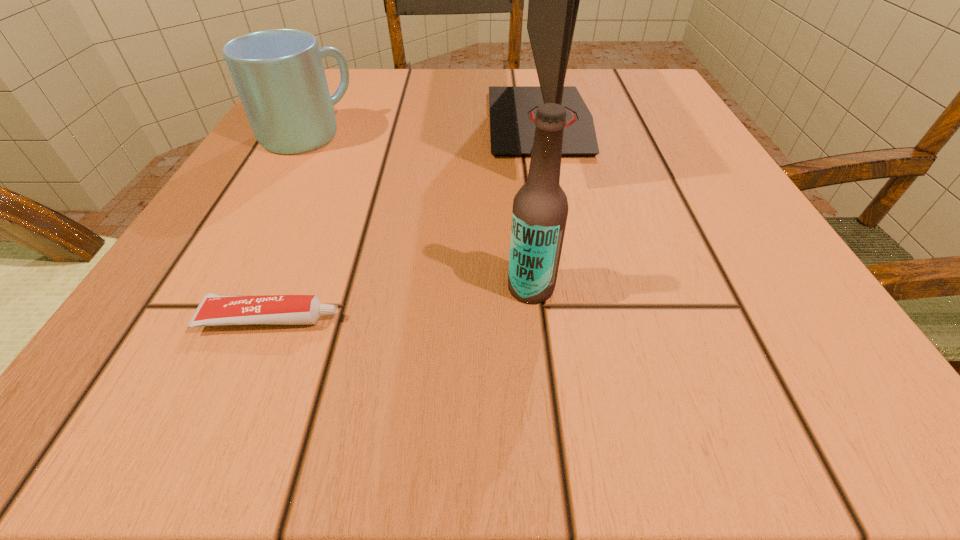
The height and width of the screenshot is (540, 960). Find the location of `vacant area at the right edge`. vacant area at the right edge is located at coordinates (755, 326).

The image size is (960, 540). What are the coordinates of `free space at the far left corner of the desktop` in the screenshot? It's located at (358, 122).

In the image, there is a desktop. What are the coordinates of `free space at the near left corner` in the screenshot? It's located at (121, 411).

Find the location of a particular element. Image resolution: width=960 pixels, height=540 pixels. vacant space at the far right corner of the desktop is located at coordinates (606, 123).

Find the location of a particular element. The width and height of the screenshot is (960, 540). free space at the near right corner of the desktop is located at coordinates [832, 394].

Locate an element on the screen. The image size is (960, 540). free area in between the third shortest object and the toothpaste is located at coordinates (401, 303).

The height and width of the screenshot is (540, 960). What are the coordinates of `free space that is in between the beer bottle and the shortest object` in the screenshot? It's located at (401, 303).

You are a GUI agent. You are given a task and a screenshot of the screen. Output one action in this format:
    pyautogui.click(x=<x>, y=<y>)
    Task: Click on the unoccupied position between the shortest object and the third shortest object
    This screenshot has width=960, height=540.
    Given the screenshot: What is the action you would take?
    coord(401,303)

Where is `vacant area that lies between the toothpaste and the beer bottle`? This screenshot has height=540, width=960. vacant area that lies between the toothpaste and the beer bottle is located at coordinates (401, 303).

Identify the location of vacant area that lies between the third shortest object and the toothpaste. The image size is (960, 540). (401, 303).